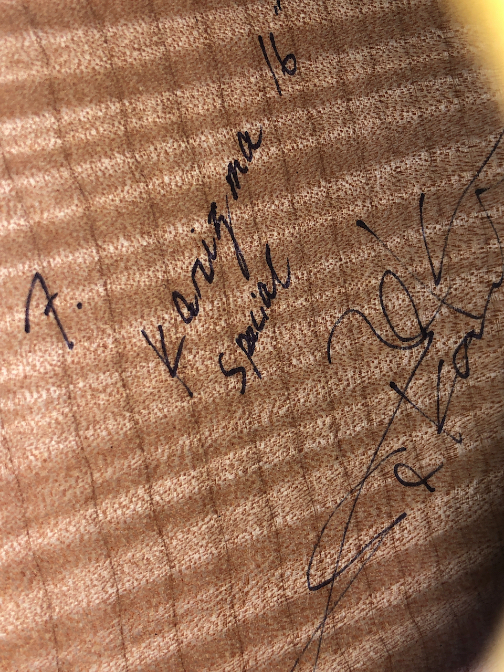
At what (x,y) coordinates should I click in order to perform the action: click on black marker. Please return your answer as a coordinate pair (x, y). Looking at the image, I should click on (248, 349).